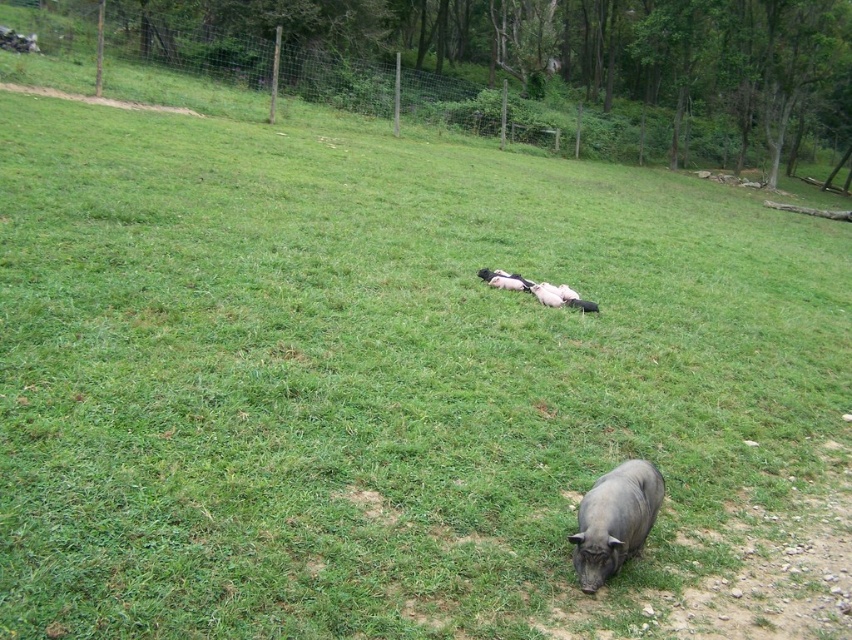
You are a farmer checking the field and see the gray matte pig at lower center and the pink soft piglets at center. Which animal is closer to you?

The gray matte pig at lower center is closer to you because it is positioned under the pink soft piglets at center, indicating it is in front of them.

You are standing at the origin point in the image. The gray matte pig at lower center is located at point [614,520]. Which direction should you move to reach the gray matte pig at lower center?

The gray matte pig at lower center is located at point [614,520], so you should move towards the bottom right direction to reach it.

You are standing in a grassy farm area and want to reach a specific point marked at coordinates point (613, 484). If you can walk 4 meters before getting tired, will you be able to reach that point without resting?

The distance of point (613, 484) from viewer is 3.77 meters, so yes, you can reach it without resting since it is within your 4 meter walking limit.